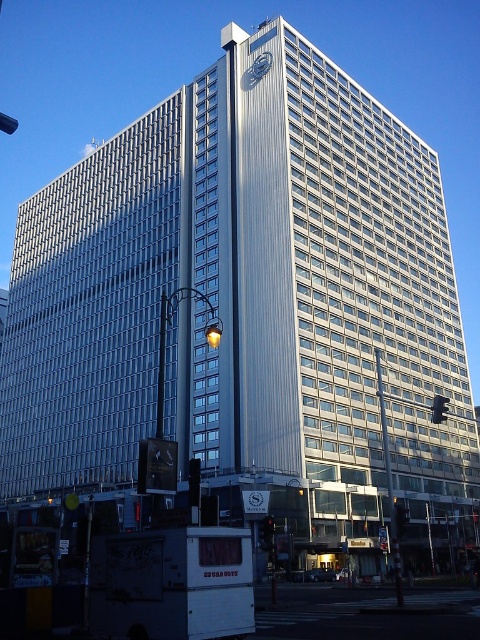
Based on the photo, does metallic pole at center-right appear on the left side of metallic clock at upper center?

Incorrect, metallic pole at center-right is not on the left side of metallic clock at upper center.

Who is lower down, metallic pole at center-right or metallic clock at upper center?

metallic pole at center-right is below.

Between point (387, 442) and point (269, 67), which one is positioned in front?

Point (387, 442) is in front.

I want to click on metallic pole at center-right, so click(x=388, y=483).